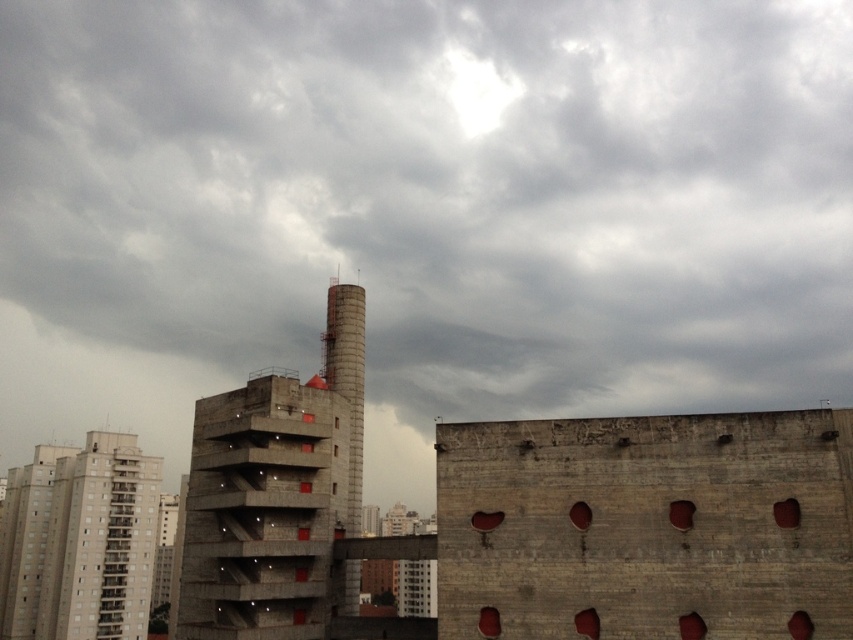
You are a city planner reviewing this urban layout. You need to determine the relative positioning of the gray concrete building at lower left and the smooth concrete chimney at center. Which object is located to the left of the other?

The gray concrete building at lower left is positioned on the left side of smooth concrete chimney at center.

You are an architect evaluating the urban layout. Considering the gray concrete building at lower left and the smooth concrete chimney at center, which one is shorter?

The gray concrete building at lower left is shorter than the smooth concrete chimney at center.